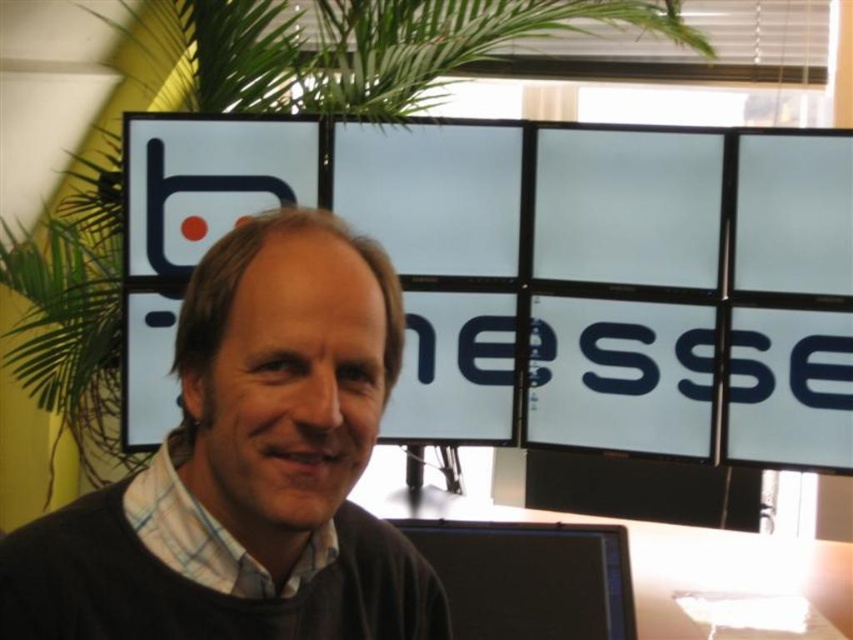
Is dark brown sweater at center taller than black glossy monitor at lower center?

Indeed, dark brown sweater at center has a greater height compared to black glossy monitor at lower center.

Is dark brown sweater at center closer to camera compared to black glossy monitor at lower center?

Yes, dark brown sweater at center is in front of black glossy monitor at lower center.

Who is more distant from viewer, [329,497] or [532,573]?

The point [532,573] is behind.

This screenshot has width=853, height=640. I want to click on dark brown sweater at center, so click(247, 468).